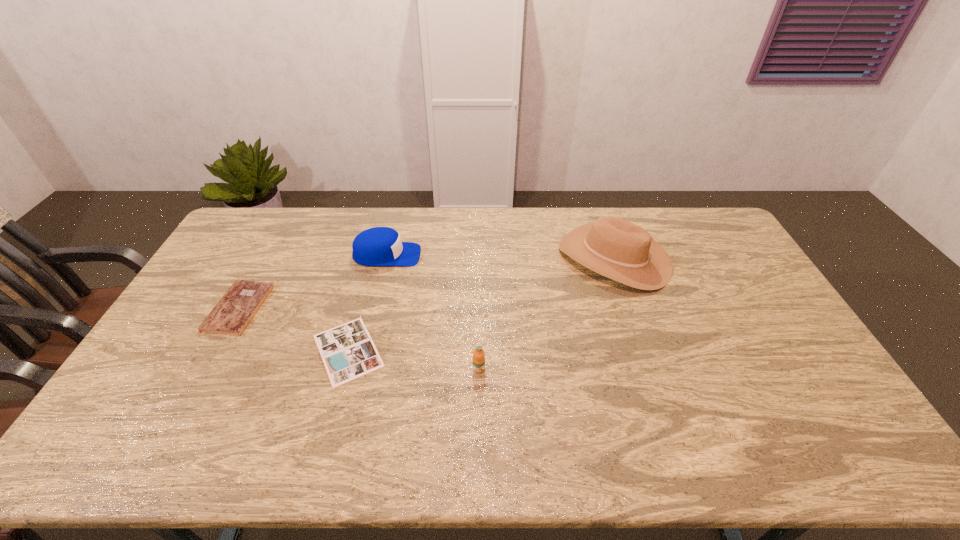
Identify the location of the second closest object to the shortest object. This screenshot has width=960, height=540. (379, 246).